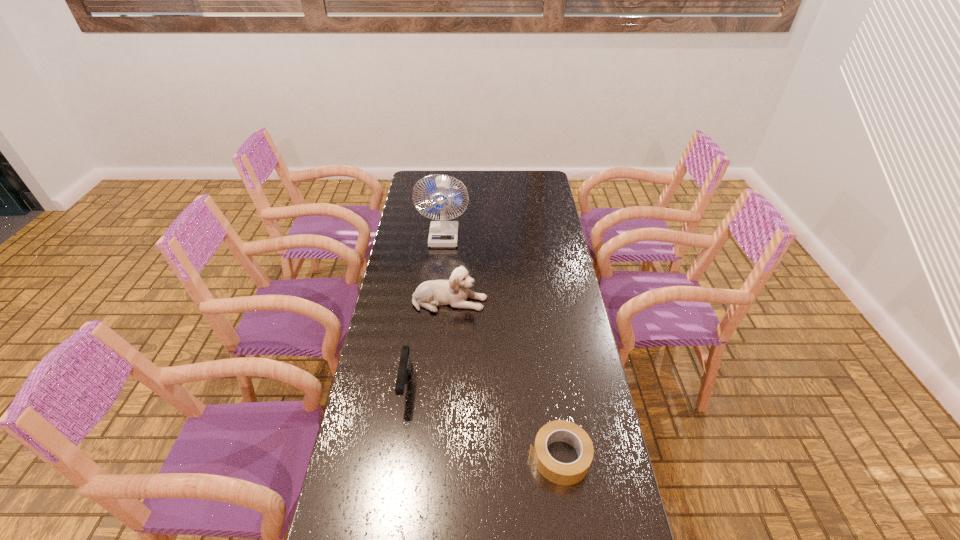
You are a GUI agent. You are given a task and a screenshot of the screen. Output one action in this format:
    pyautogui.click(x=<x>, y=<y>)
    Task: Click on the free space at the right edge of the desktop
    The height and width of the screenshot is (540, 960).
    Given the screenshot: What is the action you would take?
    pyautogui.click(x=593, y=468)

At what (x,y) coordinates should I click in order to perform the action: click on vacant space at the far right corner of the desktop. Please return your answer as a coordinate pair (x, y). Looking at the image, I should click on (538, 182).

This screenshot has width=960, height=540. I want to click on vacant area between the third farthest object and the shortest object, so click(x=483, y=422).

Identify the location of vacant area between the puppy and the farthest object. (446, 268).

Identify the location of blank region between the shortest object and the second farthest object. The height and width of the screenshot is (540, 960). (505, 379).

Where is `vacant area that lies between the third tallest object and the third shortest object`? vacant area that lies between the third tallest object and the third shortest object is located at coordinates (428, 344).

The height and width of the screenshot is (540, 960). Find the location of `free space that is in between the rightmost object and the tallest object`. free space that is in between the rightmost object and the tallest object is located at coordinates (502, 346).

The image size is (960, 540). What are the coordinates of `object that stands as the second closest to the third farthest object` in the screenshot? It's located at (556, 472).

Identify the location of object that ranks as the second closest to the second farthest object. The height and width of the screenshot is (540, 960). (443, 233).

What are the coordinates of `vacant space that satisfies the following two spatial constraints: 1. on the front-facing side of the puppy; 2. on the front-facing side of the pistol` in the screenshot? It's located at (444, 387).